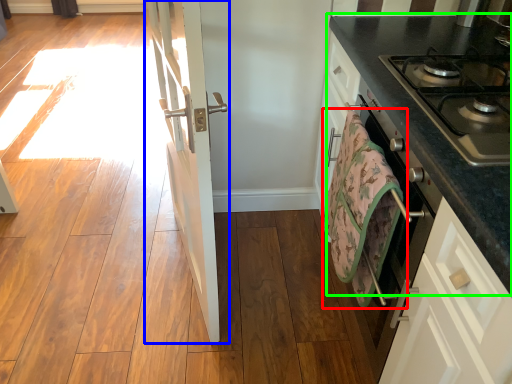
Question: Which is farther away from beach towel (highlighted by a red box)? door (highlighted by a blue box) or countertop (highlighted by a green box)?

Choices:
 (A) door
 (B) countertop

Answer: (A)